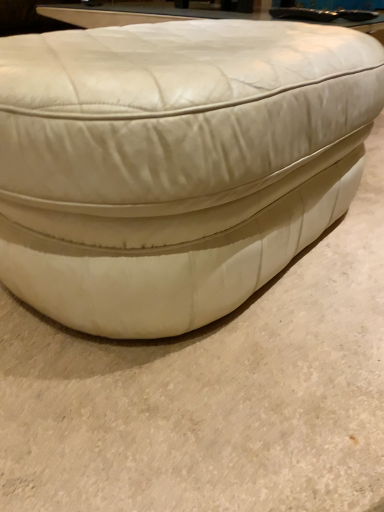
Question: Should I look upward or downward to see white leather ottoman at center?

Choices:
 (A) up
 (B) down

Answer: (A)